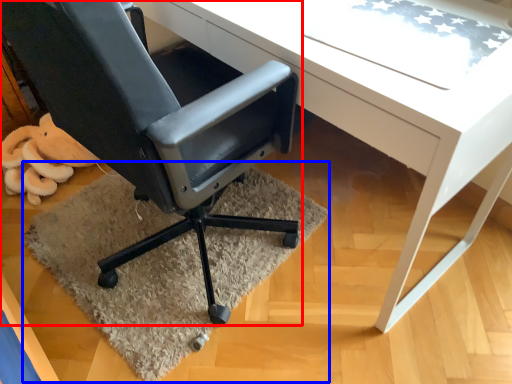
Question: Which point is further to the camera, chair (highlighted by a red box) or mat (highlighted by a blue box)?

Choices:
 (A) chair
 (B) mat

Answer: (B)